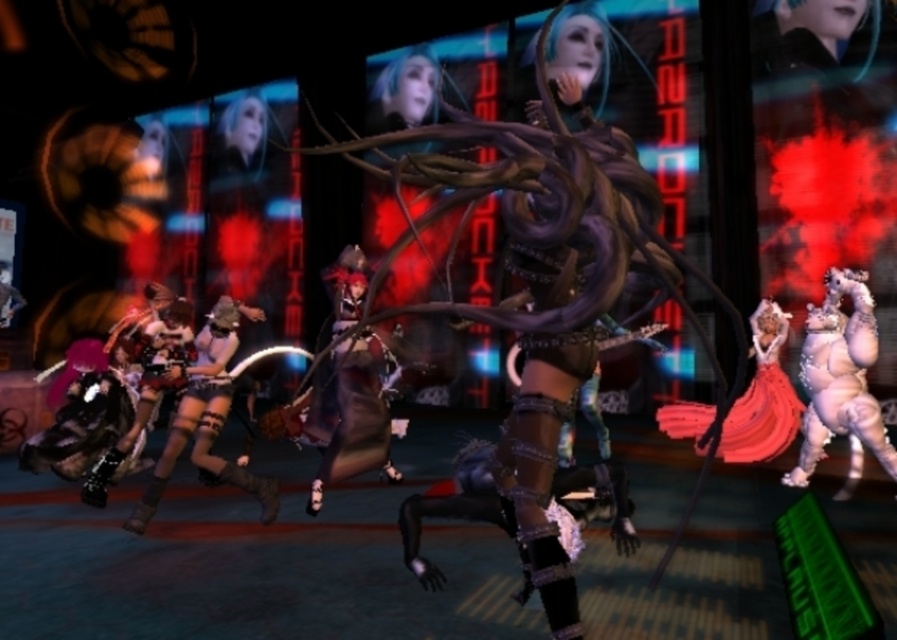
Is shiny black armor at center thinner than shiny metallic armor at lower left?

Correct, shiny black armor at center's width is less than shiny metallic armor at lower left's.

How much distance is there between shiny black armor at center and shiny metallic armor at lower left?

Result: The distance of shiny black armor at center from shiny metallic armor at lower left is 24.12 inches.

Is point (336, 355) positioned in front of point (234, 340)?

No, it is behind (234, 340).

The image size is (897, 640). Find the location of `shiny black armor at center`. shiny black armor at center is located at coordinates (347, 387).

Who is shorter, shiny black armor at center or pink flesh-colored figure at right?

Standing shorter between the two is pink flesh-colored figure at right.

Find the location of a particular element. shiny black armor at center is located at coordinates (347, 387).

Between point (884, 429) and point (771, 451), which one is positioned in front?

Positioned in front is point (884, 429).

Find the location of a particular element. Image resolution: width=897 pixels, height=640 pixels. pink flesh-colored figure at right is located at coordinates (839, 376).